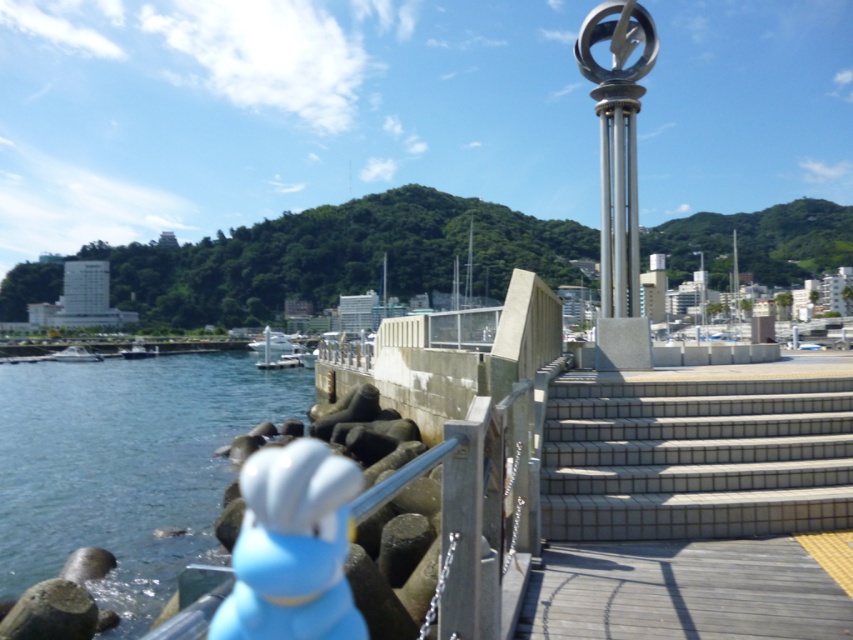
You are standing on the pier and want to walk towards the monument on the platform. You see the white tile stairs at center and the dark blue metallic boat at lower left. Which object should you move towards first?

You should move towards the white tile stairs at center first because it is in front of the dark blue metallic boat at lower left, meaning it is closer to your current position on the pier.

You are standing at the center of the image and want to walk towards the blue water at lower left. Based on the 2D coordinates provided, in which general direction should you move?

The blue water at lower left is located at point 0.728 on the x axis and 0.148 on the y axis. Since lower left in the image corresponds to lower x and lower y coordinates, moving towards the blue water at lower left would require moving to the left and downward from the center.